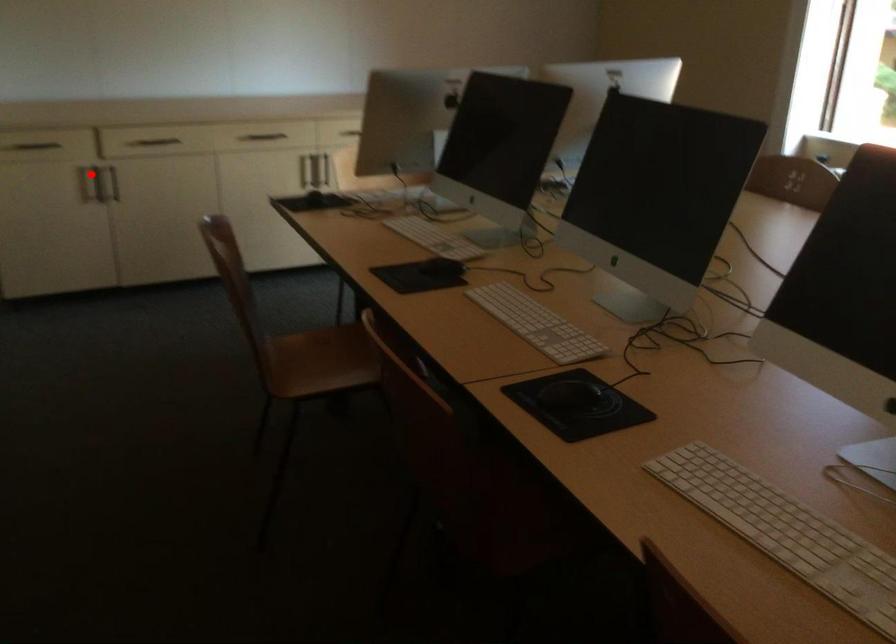
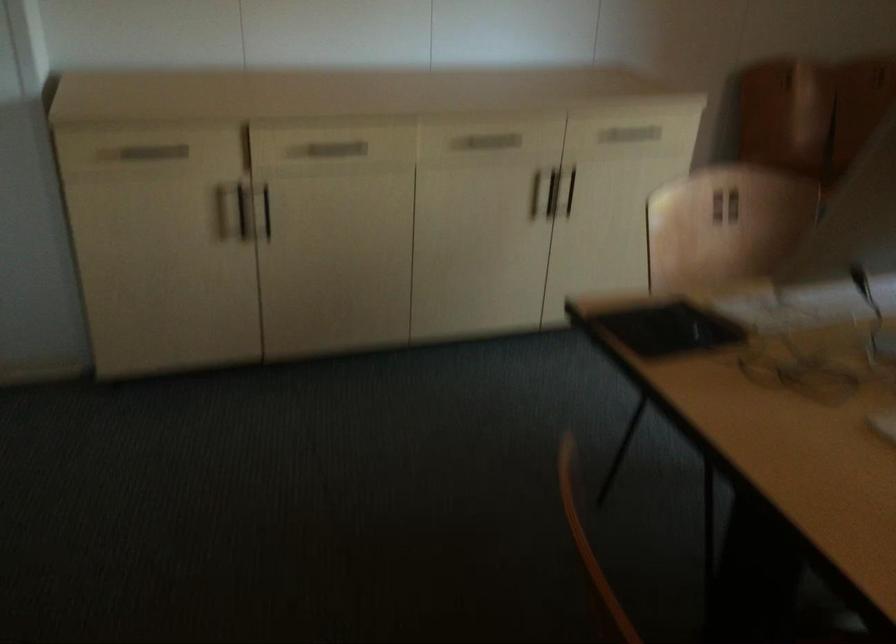
Question: I am providing you with two images of the same scene from different viewpoints. Given a red point in image1, look at the same physical point in image2. Is it:

Choices:
 (A) Closer to the viewpoint
 (B) Farther from the viewpoint

Answer: (A)